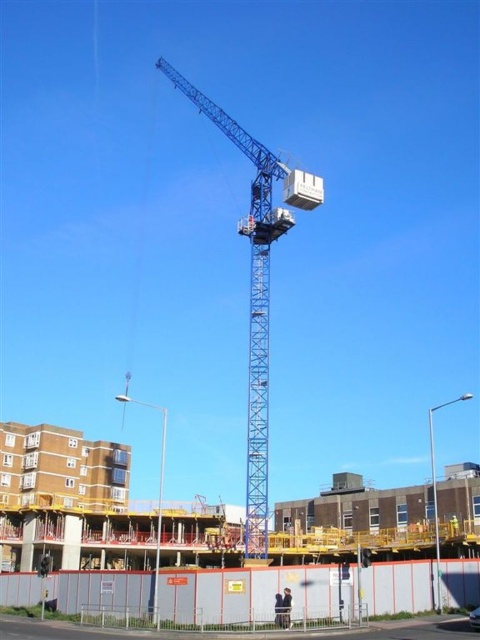
You are a construction worker who needs to reach the top of the blue metallic crane at center to perform maintenance. You have access to the white plastic lift at upper center. Can the lift reach the top of the crane?

The blue metallic crane at center is much taller than the white plastic lift at upper center, so the lift cannot reach the top of the crane.

You are a worker standing at the edge of the construction site. You need to move a heavy tool from the blue metallic crane at center to the white plastic lift at upper center. Which direction should you move the tool to reach the lift?

The blue metallic crane at center is positioned on the left side of white plastic lift at upper center, so you should move the tool to the right to reach the lift.